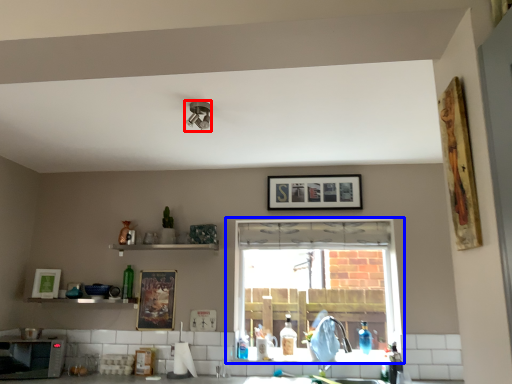
Question: Which object appears farthest to the camera in this image, light fixture (highlighted by a red box) or window (highlighted by a blue box)?

Choices:
 (A) light fixture
 (B) window

Answer: (B)